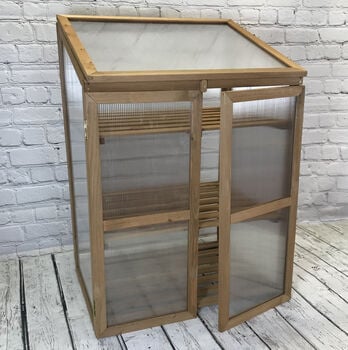
This screenshot has height=350, width=348. Find the location of `wood floor`. wood floor is located at coordinates (320, 318).